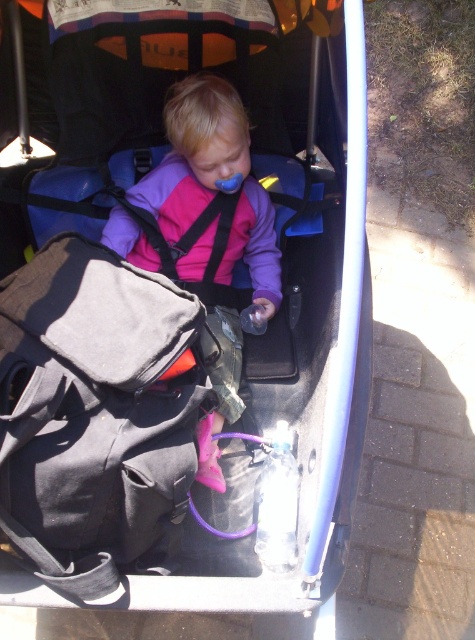
You are a parent standing next to the stroller. You need to grab your bag quickly. Is the black fabric bag at lower left within easy reach without moving the stroller?

The black fabric bag at lower left is 1.19 meters away from the viewer, so it is within easy reach without needing to move the stroller.

You are a parent holding a baby bottle. You want to place it in the closest available storage spot to the camera. The stroller has two clear plastic bottles and a black fabric bag at lower left. Which storage spot should you choose?

The black fabric bag at lower left is the closest storage spot to the camera at 1.19 meters, so you should place the baby bottle there.